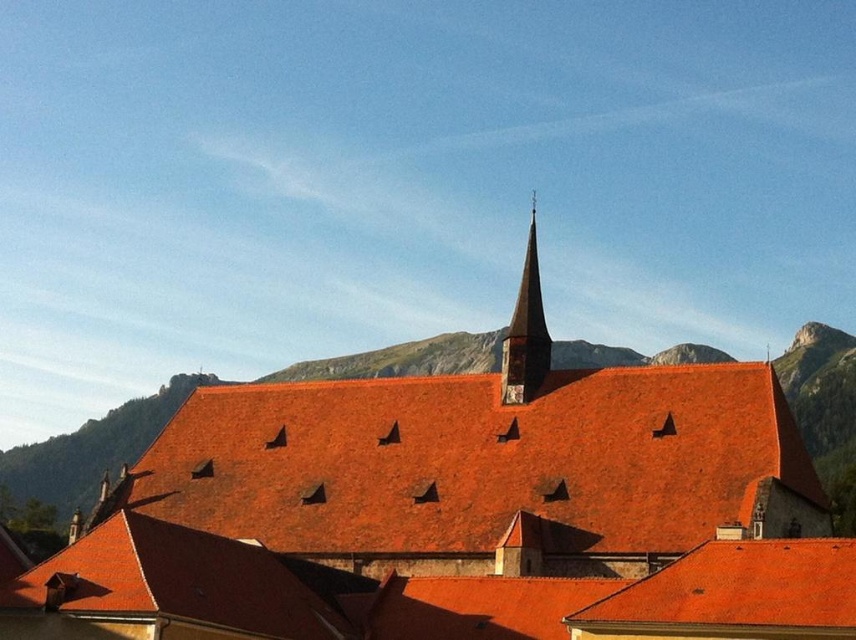
Question: Which of the following is the closest to the observer?

Choices:
 (A) (595, 460)
 (B) (513, 310)

Answer: (A)

Question: Which of the following is the farthest from the observer?

Choices:
 (A) (548, 339)
 (B) (788, 554)

Answer: (A)

Question: Does shiny orange tiles at center have a smaller size compared to smooth stone spire at upper center?

Choices:
 (A) no
 (B) yes

Answer: (B)

Question: Which point is closer to the camera?

Choices:
 (A) [526, 320]
 (B) [531, 518]
 (C) [569, 493]

Answer: (B)

Question: Can you confirm if shiny orange tiles at center is positioned to the left of smooth stone spire at upper center?

Choices:
 (A) yes
 (B) no

Answer: (A)

Question: Is matte orange roof at center to the left of smooth stone spire at upper center from the viewer's perspective?

Choices:
 (A) yes
 (B) no

Answer: (A)